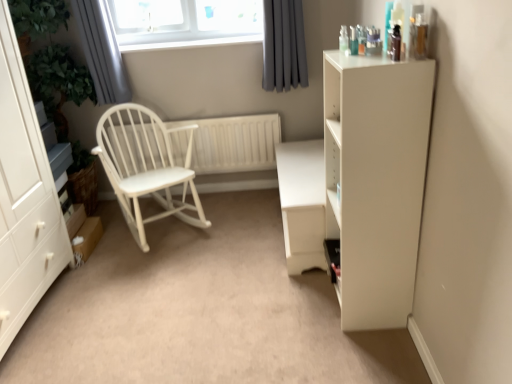
At what (x,y) coordinates should I click in order to perform the action: click on free region on the left part of white matte cabinet at right. Please return your answer as a coordinate pair (x, y). The image size is (512, 384). Looking at the image, I should click on (292, 305).